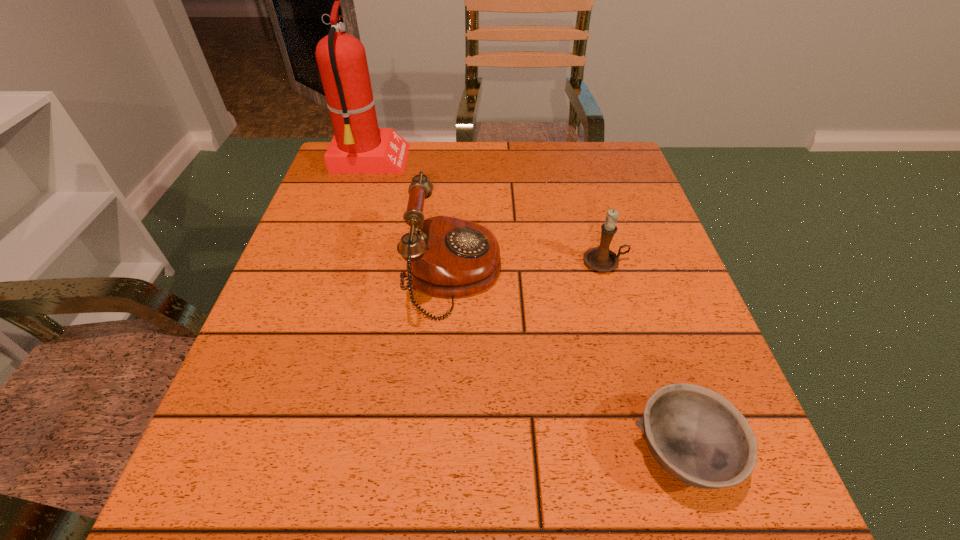
Locate an element on the screen. This screenshot has height=540, width=960. vacant area that lies between the second shortest object and the third object from right to left is located at coordinates (529, 268).

Find the location of a particular element. The image size is (960, 540). free spot between the bowl and the candle holder is located at coordinates (643, 357).

Locate an element on the screen. unoccupied position between the fire extinguisher and the bowl is located at coordinates (526, 306).

Identify the location of the second closest object relative to the telephone. (358, 146).

Select which object is the second closest to the fire extinguisher. Please provide its 2D coordinates. Your answer should be formatted as a tuple, i.e. [(x, y)], where the tuple contains the x and y coordinates of a point satisfying the conditions above.

[(601, 259)]

This screenshot has height=540, width=960. What are the coordinates of `vacant space that satisfies the following two spatial constraints: 1. on the front-facing side of the leftmost object; 2. on the right side of the nearest object` in the screenshot? It's located at (276, 452).

Locate an element on the screen. vacant region that satisfies the following two spatial constraints: 1. on the front-facing side of the tallest object; 2. on the right side of the bowl is located at coordinates (276, 452).

Where is `vacant space that satisfies the following two spatial constraints: 1. on the side of the bowl with the handle; 2. on the right side of the candle holder`? vacant space that satisfies the following two spatial constraints: 1. on the side of the bowl with the handle; 2. on the right side of the candle holder is located at coordinates (659, 452).

Where is `vacant space that satisfies the following two spatial constraints: 1. on the back side of the bowl; 2. on the dial of the third shortest object`? This screenshot has width=960, height=540. vacant space that satisfies the following two spatial constraints: 1. on the back side of the bowl; 2. on the dial of the third shortest object is located at coordinates (625, 274).

Image resolution: width=960 pixels, height=540 pixels. Identify the location of vacant point that satisfies the following two spatial constraints: 1. on the back side of the shortest object; 2. on the side of the third tallest object with the handle. (621, 262).